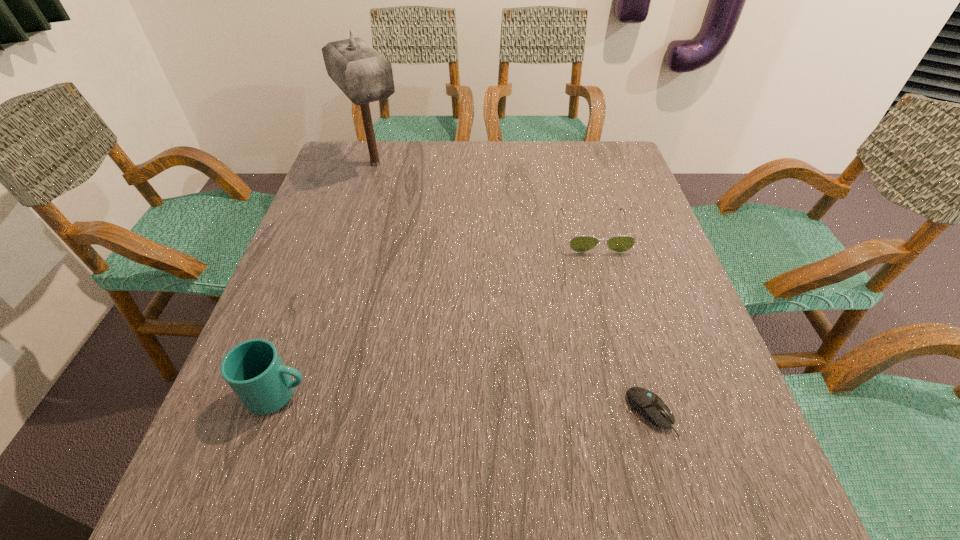
This screenshot has height=540, width=960. In order to click on vacant space at the far left corner of the desktop in this screenshot , I will do `click(365, 170)`.

Identify the location of free region at the near right corner of the desktop. (708, 506).

Identify the location of vacant space that is in between the mallet and the shortest object. The width and height of the screenshot is (960, 540). (513, 288).

Locate an element on the screen. This screenshot has height=540, width=960. free spot between the tallest object and the shortest object is located at coordinates (513, 288).

The height and width of the screenshot is (540, 960). I want to click on free space between the sunglasses and the cup, so click(x=436, y=313).

The image size is (960, 540). What are the coordinates of `empty space that is in between the tallest object and the third nearest object` in the screenshot? It's located at (485, 198).

What are the coordinates of `vacant area that lies between the second tallest object and the shortest object` in the screenshot? It's located at (465, 403).

Where is `free area in between the second shortest object and the cup`? The height and width of the screenshot is (540, 960). free area in between the second shortest object and the cup is located at coordinates (436, 313).

Locate an element on the screen. Image resolution: width=960 pixels, height=540 pixels. free spot between the computer mouse and the second shortest object is located at coordinates point(622,322).

Identify the location of vacant area that lies between the computer mouse and the cup. (465, 403).